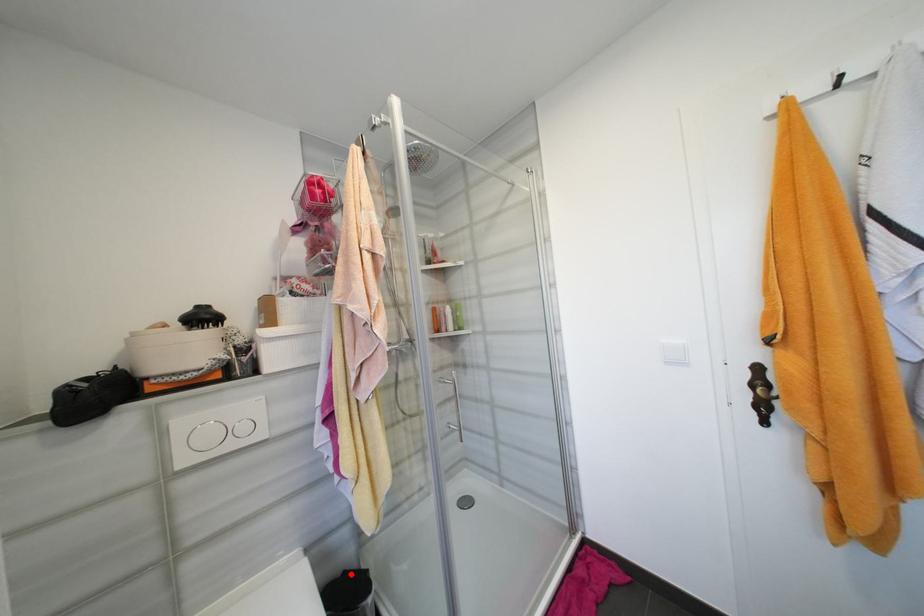
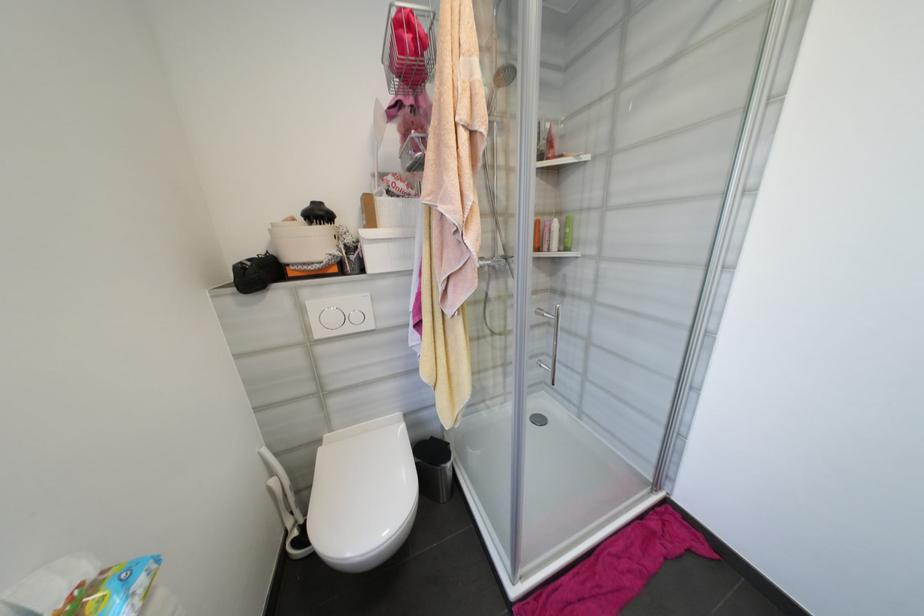
Where in the second image is the point corresponding to the highlighted location from the first image?

(438, 440)